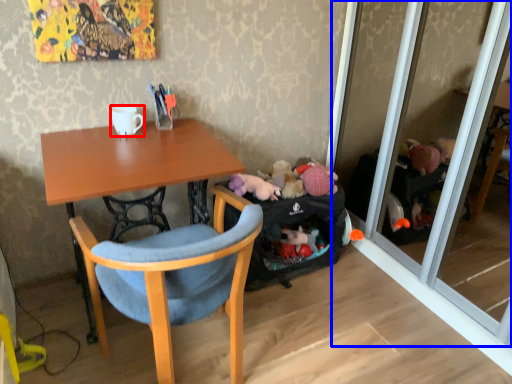
Question: Which object is closer to the camera taking this photo, coffee cup (highlighted by a red box) or screen door (highlighted by a blue box)?

Choices:
 (A) coffee cup
 (B) screen door

Answer: (B)